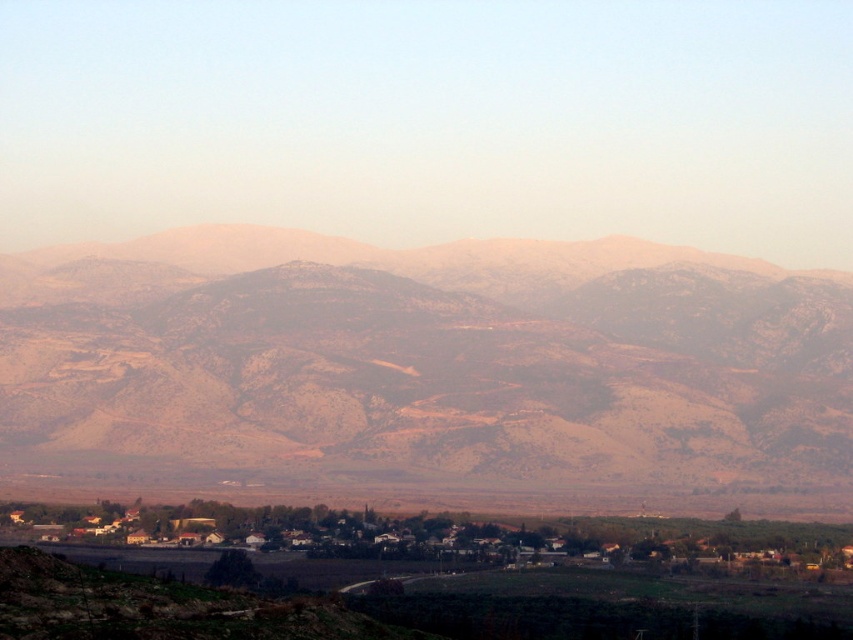
Question: Does rustic brown mountains at center have a greater width compared to brown wooden houses at center?

Choices:
 (A) no
 (B) yes

Answer: (B)

Question: Which of the following is the farthest from the observer?

Choices:
 (A) (227, 512)
 (B) (107, 280)

Answer: (B)

Question: Where is rustic brown mountains at center located in relation to brown wooden houses at center in the image?

Choices:
 (A) left
 (B) right

Answer: (A)

Question: Does rustic brown mountains at center have a larger size compared to brown wooden houses at center?

Choices:
 (A) no
 (B) yes

Answer: (B)